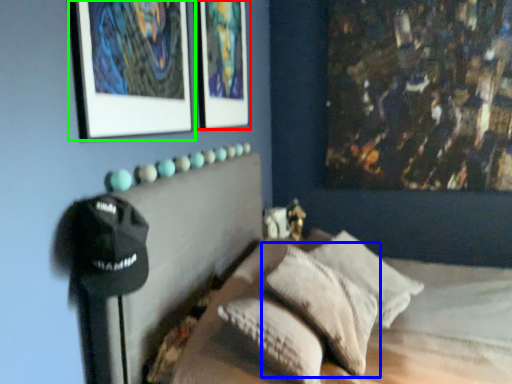
Question: Which object is positioned farthest from picture frame (highlighted by a red box)? Select from pillow (highlighted by a blue box) and picture frame (highlighted by a green box).

Choices:
 (A) pillow
 (B) picture frame

Answer: (A)